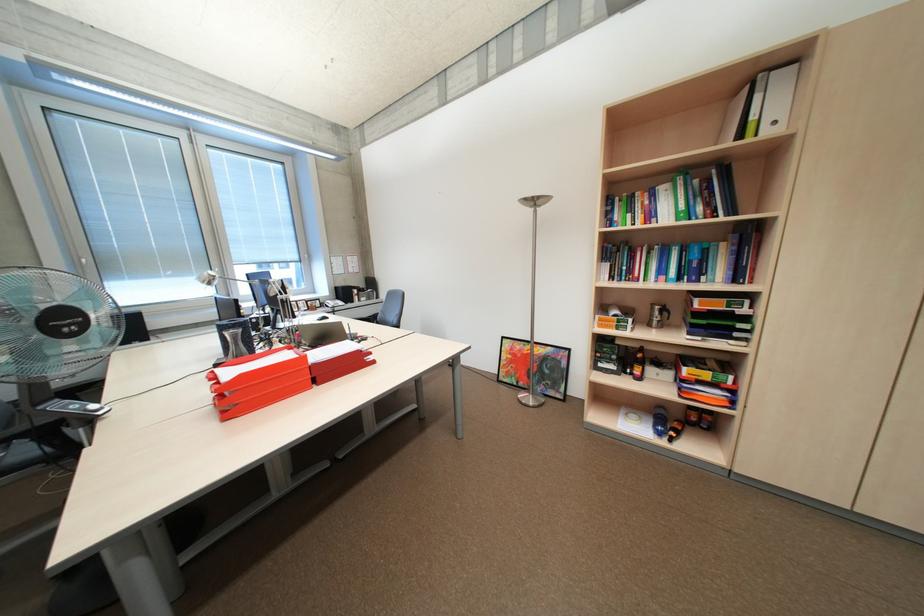
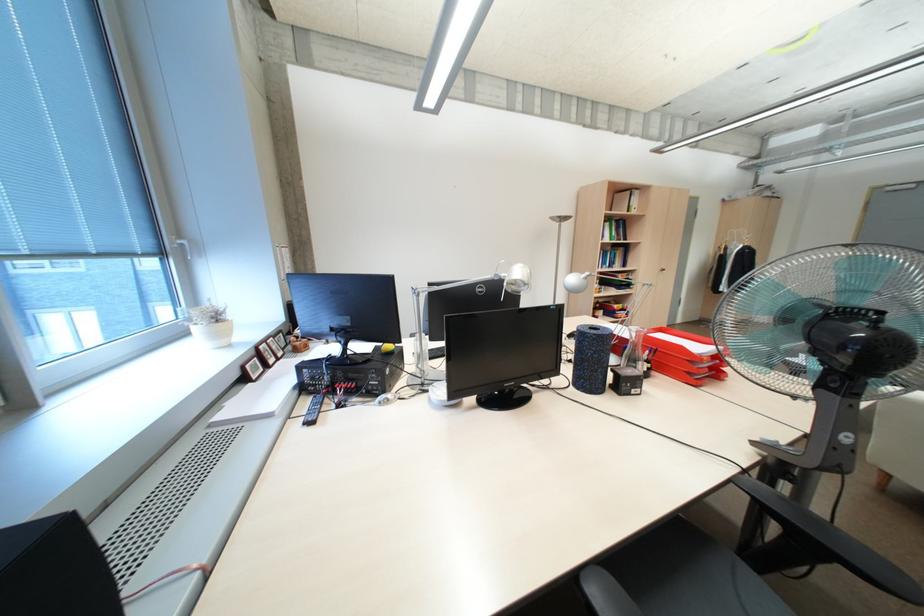
Locate, in the second image, the point that corresponds to the point at 672,270 in the first image.

(614, 262)